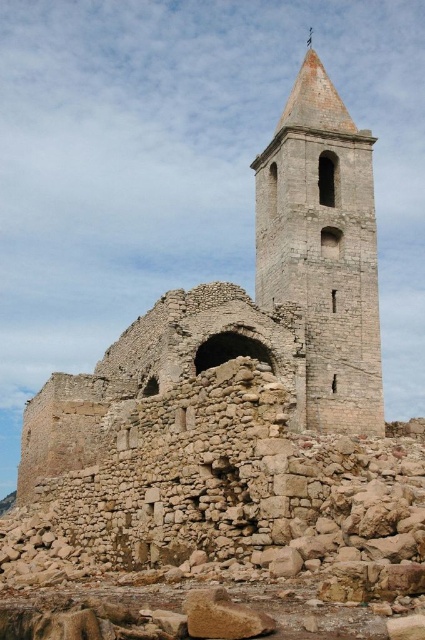
Question: Can you confirm if rustic stone ruins at center is positioned to the right of stone bell tower at center?

Choices:
 (A) yes
 (B) no

Answer: (B)

Question: Which point appears closest to the camera in this image?

Choices:
 (A) (227, 304)
 (B) (300, 134)

Answer: (A)

Question: Does rustic stone ruins at center have a greater width compared to stone bell tower at center?

Choices:
 (A) no
 (B) yes

Answer: (B)

Question: Which of the following is the closest to the observer?

Choices:
 (A) stone bell tower at center
 (B) rustic stone ruins at center

Answer: (B)

Question: Is rustic stone ruins at center closer to camera compared to stone bell tower at center?

Choices:
 (A) no
 (B) yes

Answer: (B)